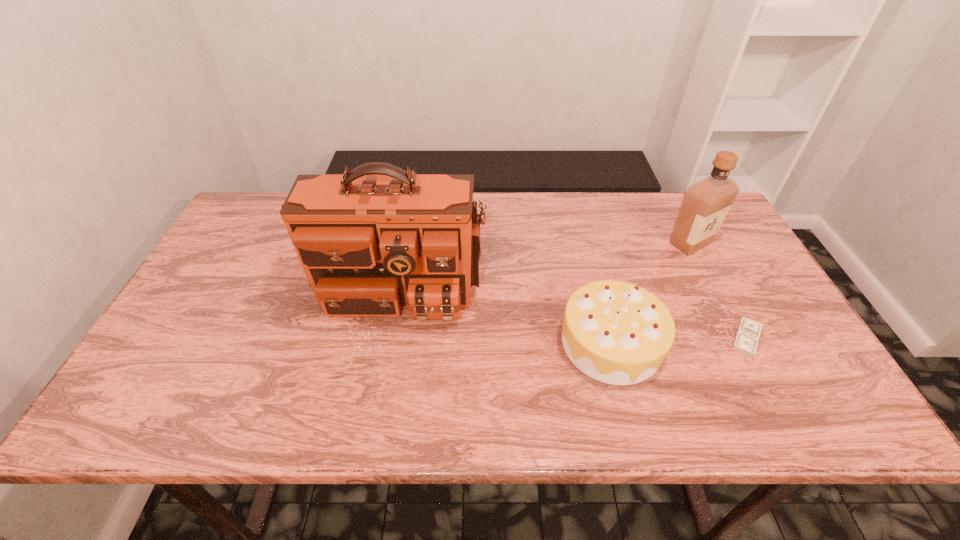
Identify the location of free spot between the money and the liquor. The height and width of the screenshot is (540, 960). (718, 291).

Where is `vacant region between the satchel and the third shortest object`? vacant region between the satchel and the third shortest object is located at coordinates (547, 254).

Identify the location of vacant area that lies between the birthday cake and the shortest object. pos(679,341).

Identify the location of vacant space that is in between the satchel and the second object from left to right. (507, 303).

What are the coordinates of `empty space between the third object from right to left and the shortest object` in the screenshot? It's located at (679, 341).

Identify which object is located as the nearest to the birthday cake. Please provide its 2D coordinates. Your answer should be formatted as a tuple, i.e. [(x, y)], where the tuple contains the x and y coordinates of a point satisfying the conditions above.

[(747, 336)]

Identify which object is located as the third nearest to the satchel. Please provide its 2D coordinates. Your answer should be formatted as a tuple, i.e. [(x, y)], where the tuple contains the x and y coordinates of a point satisfying the conditions above.

[(747, 336)]

Locate an element on the screen. The image size is (960, 540). vacant area that satisfies the following two spatial constraints: 1. on the front-facing side of the money; 2. on the left side of the liquor is located at coordinates (739, 339).

I want to click on vacant space that satisfies the following two spatial constraints: 1. on the front-facing side of the second tallest object; 2. on the right side of the shortest object, so click(739, 339).

Find the location of a particular element. The height and width of the screenshot is (540, 960). free spot that satisfies the following two spatial constraints: 1. on the face side of the money; 2. on the right side of the satchel is located at coordinates (390, 339).